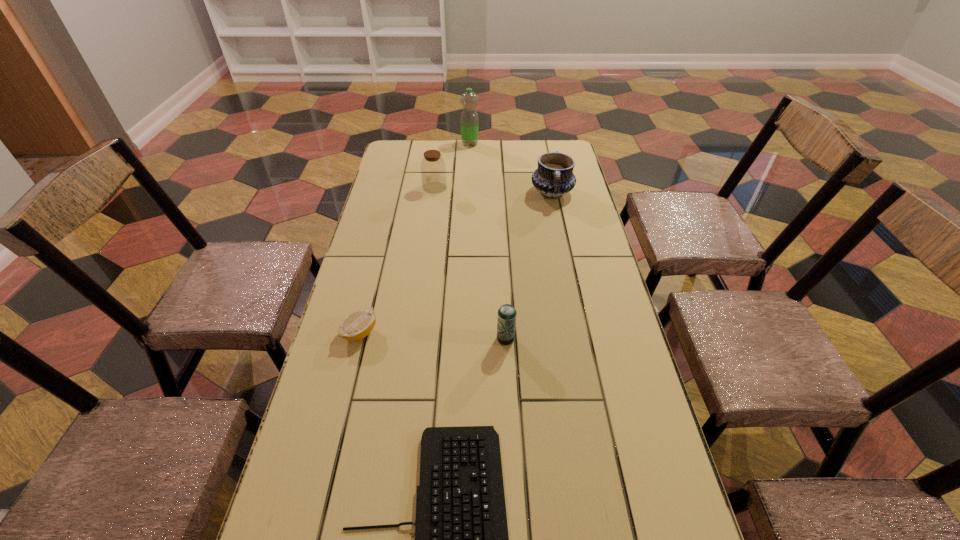
Locate an element on the screen. This screenshot has height=540, width=960. vacant point located between the leftmost object and the pottery is located at coordinates (456, 262).

You are a GUI agent. You are given a task and a screenshot of the screen. Output one action in this format:
    pyautogui.click(x=<x>, y=<y>)
    Task: Click on the vacant space in between the jar and the pottery
    The width and height of the screenshot is (960, 540).
    Given the screenshot: What is the action you would take?
    pyautogui.click(x=493, y=191)

In order to click on vacant region between the tallest object and the rightmost object in this screenshot , I will do `click(511, 168)`.

I want to click on free space between the water bottle and the beer can, so click(488, 241).

Locate an element on the screen. blank region between the pottery and the beer can is located at coordinates (529, 266).

Where is `object that ranks as the second closest to the pottery`? The width and height of the screenshot is (960, 540). object that ranks as the second closest to the pottery is located at coordinates (469, 117).

Choose which object is the fourth nearest neighbor to the farthest object. Please provide its 2D coordinates. Your answer should be formatted as a tuple, i.e. [(x, y)], where the tuple contains the x and y coordinates of a point satisfying the conditions above.

[(506, 323)]

Image resolution: width=960 pixels, height=540 pixels. What are the coordinates of `free space that satisfies the following two spatial constraints: 1. on the back side of the fifth tallest object; 2. on the right side of the tallest object` in the screenshot? It's located at coord(407,144).

Where is `vacant point that satisfies the following two spatial constraints: 1. on the back side of the jar; 2. on the left side of the tallest object`? This screenshot has width=960, height=540. vacant point that satisfies the following two spatial constraints: 1. on the back side of the jar; 2. on the left side of the tallest object is located at coordinates (441, 144).

Image resolution: width=960 pixels, height=540 pixels. Identify the location of vacant space that satisfies the following two spatial constraints: 1. on the back side of the farthest object; 2. on the left side of the lemon. (407, 144).